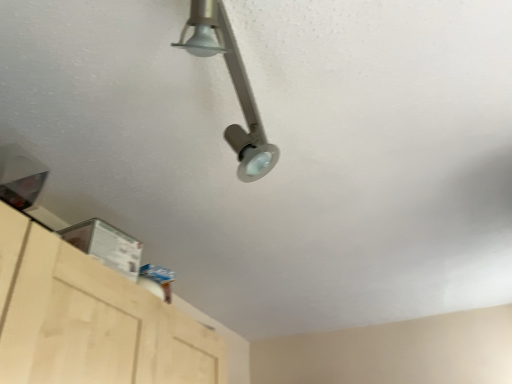
This screenshot has width=512, height=384. Describe the element at coordinates (234, 87) in the screenshot. I see `satin nickel track light at upper center` at that location.

Find the location of a particular element. This screenshot has width=512, height=384. satin nickel track light at upper center is located at coordinates (234, 87).

In order to face light wood cabinet at lower left, should I rotate leftwards or rightwards?

It's best to rotate left around 20.213 degrees.

The height and width of the screenshot is (384, 512). Describe the element at coordinates (92, 321) in the screenshot. I see `light wood cabinet at lower left` at that location.

I want to click on light wood cabinet at lower left, so click(92, 321).

Where is `satin nickel track light at upper center`? satin nickel track light at upper center is located at coordinates (234, 87).

Considering the relative positions of light wood cabinet at lower left and satin nickel track light at upper center in the image provided, is light wood cabinet at lower left to the left or to the right of satin nickel track light at upper center?

In the image, light wood cabinet at lower left appears on the left side of satin nickel track light at upper center.

Does light wood cabinet at lower left come behind satin nickel track light at upper center?

Yes, the depth of light wood cabinet at lower left is greater than that of satin nickel track light at upper center.

Which point is more distant from viewer, [188,349] or [232,45]?

Positioned behind is point [188,349].

From the image's perspective, is light wood cabinet at lower left under satin nickel track light at upper center?

Correct, light wood cabinet at lower left appears lower than satin nickel track light at upper center in the image.

From a real-world perspective, is light wood cabinet at lower left above or below satin nickel track light at upper center?

From a real-world perspective, light wood cabinet at lower left is physically below satin nickel track light at upper center.

Which of these two, light wood cabinet at lower left or satin nickel track light at upper center, is thinner?

With smaller width is satin nickel track light at upper center.

From the picture: Considering the sizes of light wood cabinet at lower left and satin nickel track light at upper center in the image, is light wood cabinet at lower left taller or shorter than satin nickel track light at upper center?

Answer: In the image, light wood cabinet at lower left appears to be taller than satin nickel track light at upper center.

Considering the relative sizes of light wood cabinet at lower left and satin nickel track light at upper center in the image provided, is light wood cabinet at lower left bigger than satin nickel track light at upper center?

Yes.

In the scene shown: Is light wood cabinet at lower left outside of satin nickel track light at upper center?

Yes.

Does light wood cabinet at lower left touch satin nickel track light at upper center?

No, light wood cabinet at lower left is not making contact with satin nickel track light at upper center.

In the scene shown: Could you tell me if light wood cabinet at lower left is facing satin nickel track light at upper center?

No.

From the picture: Can you tell me how much light wood cabinet at lower left and satin nickel track light at upper center differ in facing direction?

174 degrees.

Find the location of a particular element. Image resolution: width=512 pixels, height=384 pixels. cabinetry directly beneath the satin nickel track light at upper center (from a real-world perspective) is located at coordinates (92, 321).

Which is more to the left, satin nickel track light at upper center or light wood cabinet at lower left?

From the viewer's perspective, light wood cabinet at lower left appears more on the left side.

Is the depth of satin nickel track light at upper center less than that of light wood cabinet at lower left?

Yes, it is.

Considering the points (260, 128) and (60, 370), which point is in front, point (260, 128) or point (60, 370)?

The point (260, 128) is closer to the camera.

From the image's perspective, does satin nickel track light at upper center appear lower than light wood cabinet at lower left?

Actually, satin nickel track light at upper center appears above light wood cabinet at lower left in the image.

From a real-world perspective, which is physically below, satin nickel track light at upper center or light wood cabinet at lower left?

light wood cabinet at lower left.

Does satin nickel track light at upper center have a lesser width compared to light wood cabinet at lower left?

Yes.

Which of these two, satin nickel track light at upper center or light wood cabinet at lower left, stands taller?

light wood cabinet at lower left is taller.

Considering the sizes of objects satin nickel track light at upper center and light wood cabinet at lower left in the image provided, who is bigger, satin nickel track light at upper center or light wood cabinet at lower left?

light wood cabinet at lower left.

Would you say satin nickel track light at upper center is outside light wood cabinet at lower left?

Yes, satin nickel track light at upper center is located beyond the bounds of light wood cabinet at lower left.

Are satin nickel track light at upper center and light wood cabinet at lower left making contact?

satin nickel track light at upper center is not next to light wood cabinet at lower left, and they're not touching.

Could you tell me if satin nickel track light at upper center is facing light wood cabinet at lower left?

No, satin nickel track light at upper center is not facing towards light wood cabinet at lower left.

The width and height of the screenshot is (512, 384). Identify the location of lamp above the light wood cabinet at lower left (from the image's perspective). (234, 87).

Identify the location of cabinetry that appears below the satin nickel track light at upper center (from a real-world perspective). (92, 321).

This screenshot has height=384, width=512. I want to click on lamp that appears above the light wood cabinet at lower left (from a real-world perspective), so click(234, 87).